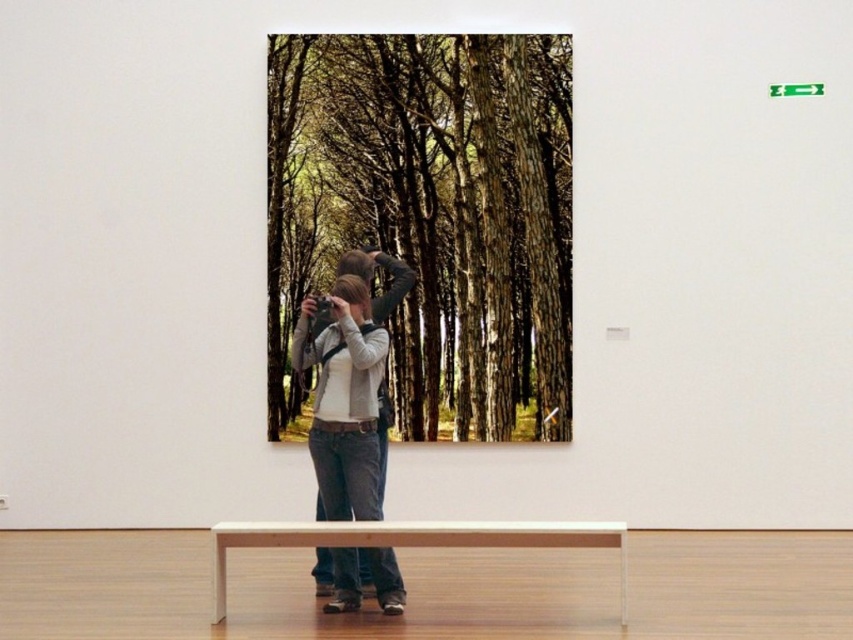
Question: Which object is the farthest from the green textured forest at center?

Choices:
 (A) denim jeans at center
 (B) light brown wooden bench at lower center

Answer: (B)

Question: Which of the following is the farthest from the observer?

Choices:
 (A) (302, 81)
 (B) (331, 586)

Answer: (A)

Question: Which object is farther from the camera taking this photo?

Choices:
 (A) light brown wooden bench at lower center
 (B) green textured forest at center

Answer: (B)

Question: Does green textured forest at center have a lesser width compared to denim jeans at center?

Choices:
 (A) yes
 (B) no

Answer: (B)

Question: Is light brown wooden bench at lower center below denim jeans at center?

Choices:
 (A) yes
 (B) no

Answer: (A)

Question: Considering the relative positions of light brown wooden bench at lower center and denim jeans at center in the image provided, where is light brown wooden bench at lower center located with respect to denim jeans at center?

Choices:
 (A) above
 (B) below

Answer: (B)